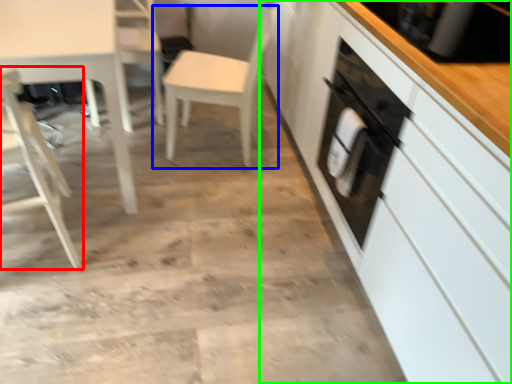
Question: Considering the real-world distances, which object is farthest from chair (highlighted by a red box)? chair (highlighted by a blue box) or cabinetry (highlighted by a green box)?

Choices:
 (A) chair
 (B) cabinetry

Answer: (B)